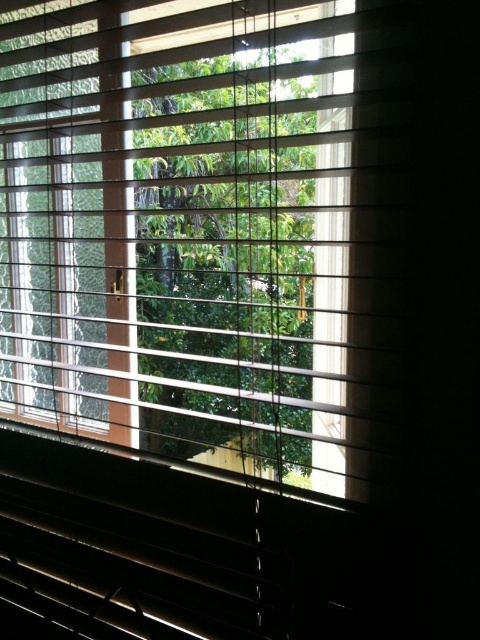
Question: Which of the following is the closest to the observer?

Choices:
 (A) wooden blinds at center
 (B) green leafy tree at center

Answer: (A)

Question: Does wooden blinds at center appear under green leafy tree at center?

Choices:
 (A) no
 (B) yes

Answer: (A)

Question: Which of the following is the closest to the observer?

Choices:
 (A) wooden blinds at center
 (B) green leafy tree at center

Answer: (A)

Question: Is wooden blinds at center smaller than green leafy tree at center?

Choices:
 (A) yes
 (B) no

Answer: (B)

Question: Does wooden blinds at center have a smaller size compared to green leafy tree at center?

Choices:
 (A) yes
 (B) no

Answer: (B)